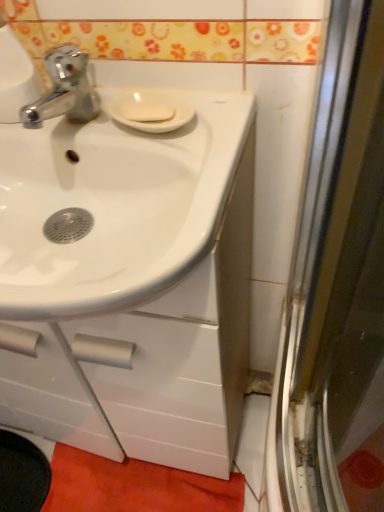
Where is `empty space that is to the right of white matte soap at center`? This screenshot has width=384, height=512. empty space that is to the right of white matte soap at center is located at coordinates (214, 112).